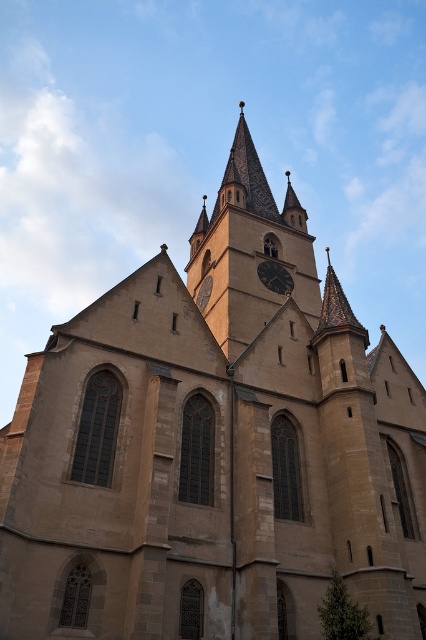
Question: Which point is farther to the camera?

Choices:
 (A) dark brown wooden clock at center
 (B) brown stone clock tower at center
 (C) dark brown stone clock at center

Answer: (C)

Question: Does brown stone clock tower at center appear under dark brown wooden clock at center?

Choices:
 (A) no
 (B) yes

Answer: (A)

Question: Estimate the real-world distances between objects in this image. Which object is farther from the dark brown wooden clock at center?

Choices:
 (A) brown stone clock tower at center
 (B) dark brown stone clock at center

Answer: (A)

Question: Is brown stone clock tower at center bigger than dark brown wooden clock at center?

Choices:
 (A) no
 (B) yes

Answer: (B)

Question: Which point appears closest to the camera in this image?

Choices:
 (A) (207, 292)
 (B) (213, 257)
 (C) (290, 282)

Answer: (C)

Question: In this image, where is brown stone clock tower at center located relative to dark brown wooden clock at center?

Choices:
 (A) below
 (B) above

Answer: (B)